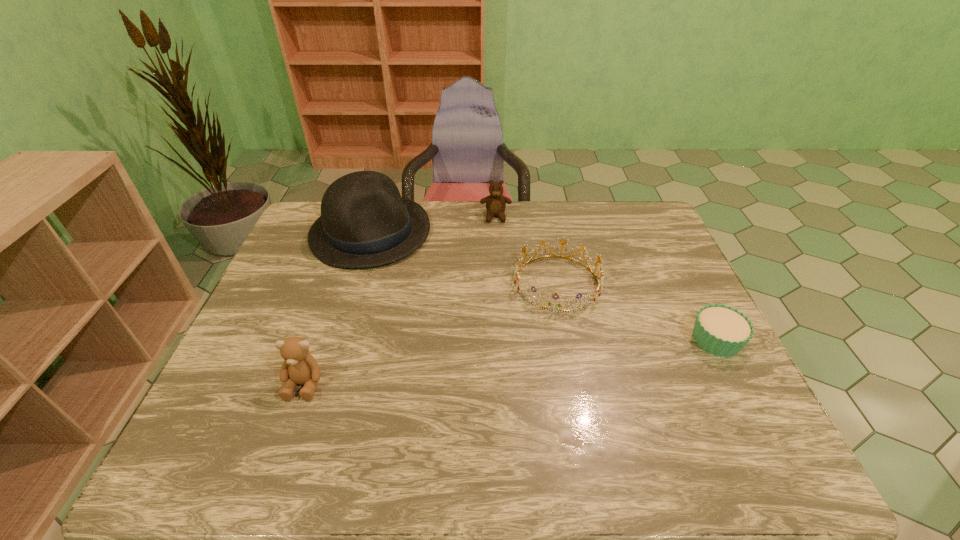
The image size is (960, 540). In order to click on free space at the far right corner of the desktop in this screenshot , I will do `click(643, 222)`.

Locate an element on the screen. vacant region at the near right corner is located at coordinates (718, 392).

Locate an element on the screen. The height and width of the screenshot is (540, 960). vacant area between the left teddy bear and the bowler hat is located at coordinates (337, 308).

At what (x,y) coordinates should I click in order to perform the action: click on blank region between the right teddy bear and the bowler hat. Please return your answer as a coordinate pair (x, y). The width and height of the screenshot is (960, 540). Looking at the image, I should click on (433, 225).

Locate an element on the screen. vacant space in between the rightmost object and the left teddy bear is located at coordinates (510, 362).

The image size is (960, 540). Identify the location of vacant area that lies between the fourth farthest object and the fourth tallest object. coord(636,312).

The height and width of the screenshot is (540, 960). Find the location of `vacant space in between the fourth tallest object and the left teddy bear`. vacant space in between the fourth tallest object and the left teddy bear is located at coordinates (431, 333).

You are a GUI agent. You are given a task and a screenshot of the screen. Output one action in this format:
    pyautogui.click(x=<x>, y=<y>)
    Task: Click on the free point between the left teddy bear and the bowler hat
    Image resolution: width=960 pixels, height=540 pixels.
    Given the screenshot: What is the action you would take?
    pyautogui.click(x=337, y=308)

In order to click on vacant point located between the tiara and the bowler hat in this screenshot , I will do `click(464, 258)`.

Identify the location of unoccupied area between the nearest object and the bowler hat. The image size is (960, 540). coord(337,308).